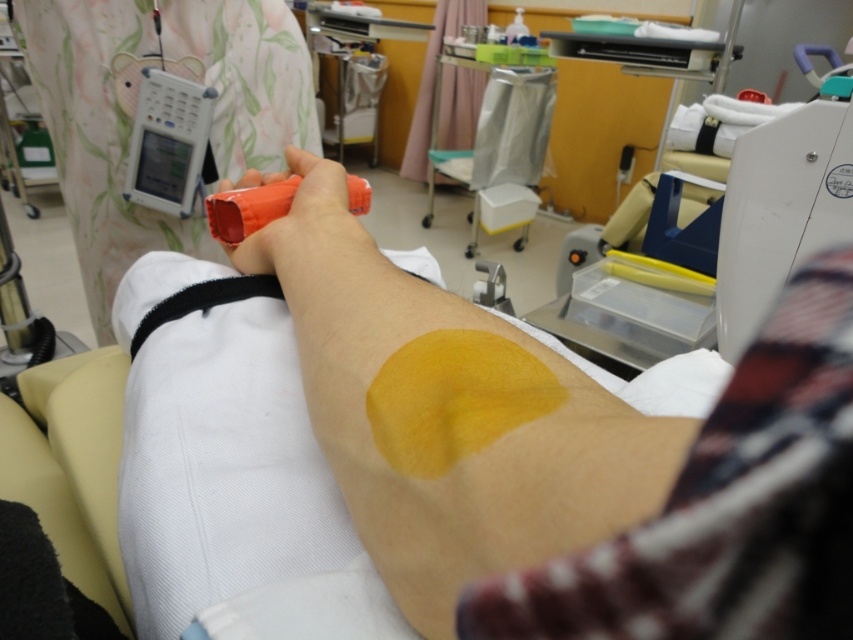
Based on the photo, can you confirm if yellow matte patch at center is positioned above rubber-like orange marker at center?

Incorrect, yellow matte patch at center is not positioned above rubber-like orange marker at center.

Identify the location of yellow matte patch at center. (448, 413).

Who is positioned more to the right, matte plastic device at upper left or rubber-like orange marker at center?

From the viewer's perspective, rubber-like orange marker at center appears more on the right side.

Can you confirm if matte plastic device at upper left is thinner than rubber-like orange marker at center?

Correct, matte plastic device at upper left's width is less than rubber-like orange marker at center's.

Between point (209, 88) and point (244, 212), which one is positioned behind?

Positioned behind is point (209, 88).

Where is `matte plastic device at upper left`? The height and width of the screenshot is (640, 853). matte plastic device at upper left is located at coordinates (167, 141).

The width and height of the screenshot is (853, 640). What do you see at coordinates (167, 141) in the screenshot?
I see `matte plastic device at upper left` at bounding box center [167, 141].

What do you see at coordinates (167, 141) in the screenshot?
I see `matte plastic device at upper left` at bounding box center [167, 141].

This screenshot has height=640, width=853. What are the coordinates of `matte plastic device at upper left` in the screenshot? It's located at (167, 141).